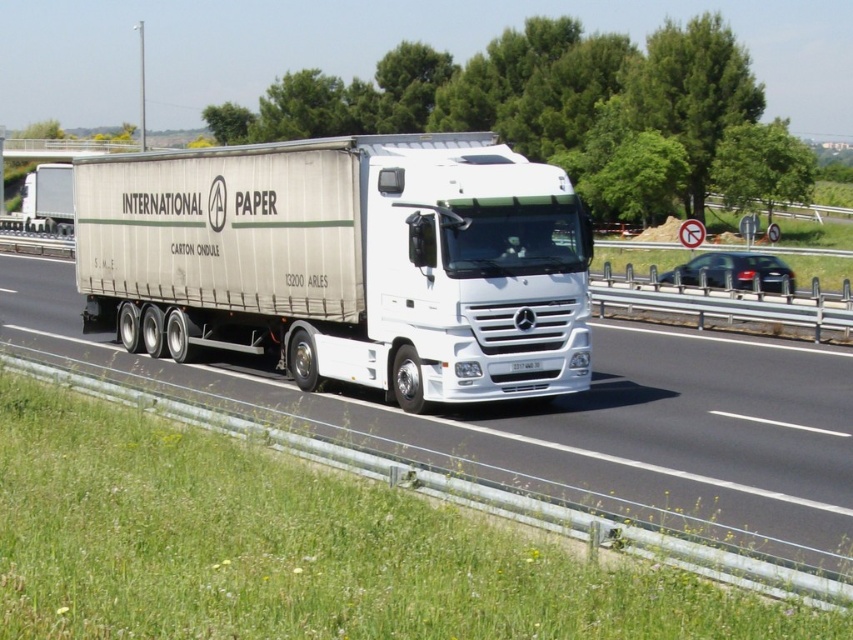
Is white matte trailer truck at center positioned at the back of white glossy truck at center?

Yes.

Is white matte trailer truck at center bigger than white glossy truck at center?

No, white matte trailer truck at center is not bigger than white glossy truck at center.

Is point (352, 172) closer to camera compared to point (51, 317)?

Yes, point (352, 172) is closer to viewer.

This screenshot has height=640, width=853. Identify the location of white matte trailer truck at center. (345, 260).